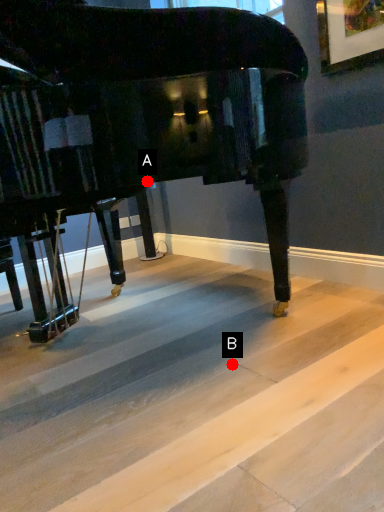
Question: Two points are circled on the image, labeled by A and B beside each circle. Which point is closer to the camera taking this photo?

Choices:
 (A) A is closer
 (B) B is closer

Answer: (B)